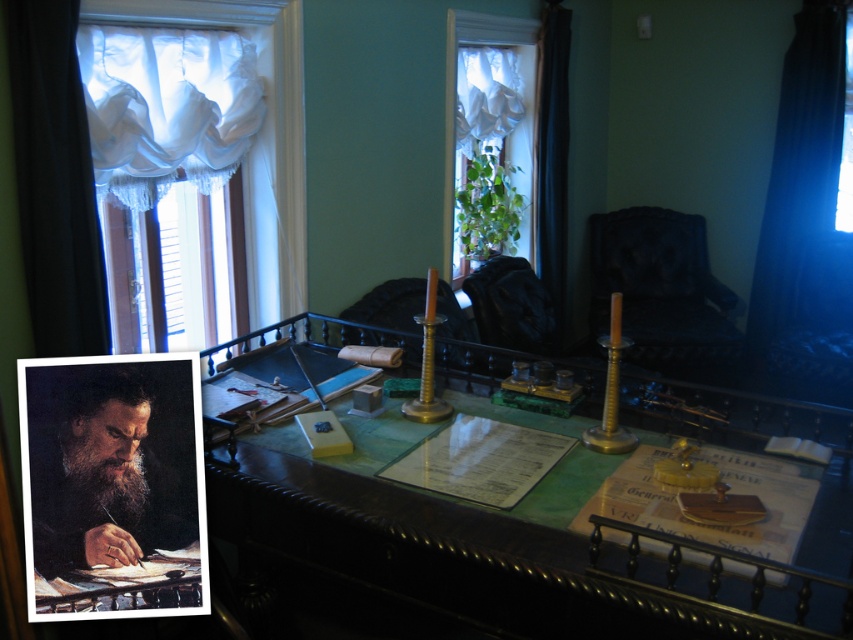
You are a delivery person who needs to place a 2.5 meter long package between the dark wood desk at center and the black fabric curtain at right. Is there enough space to fit the package horizontally between them?

The distance between the dark wood desk at center and the black fabric curtain at right is 2.32 meters, which is shorter than the 2.5 meter package. Therefore, the package cannot fit horizontally between them.

Looking at this image, you are sitting in the black velvet armchair at center and want to reach the window to adjust the black fabric curtain at left. Which direction should you turn to face the curtain?

The black fabric curtain at left is to the left of the black velvet armchair at center, so you should turn to your left to face the curtain.

You are a person with a 5.5 feet wide sofa that you want to place between the black fabric curtain at left and the black velvet armchair at center. Can you fit the sofa between them?

The distance between the black fabric curtain at left and the black velvet armchair at center is 10.47 feet. Since the sofa is 5.5 feet wide, it can fit between them as there is enough space.